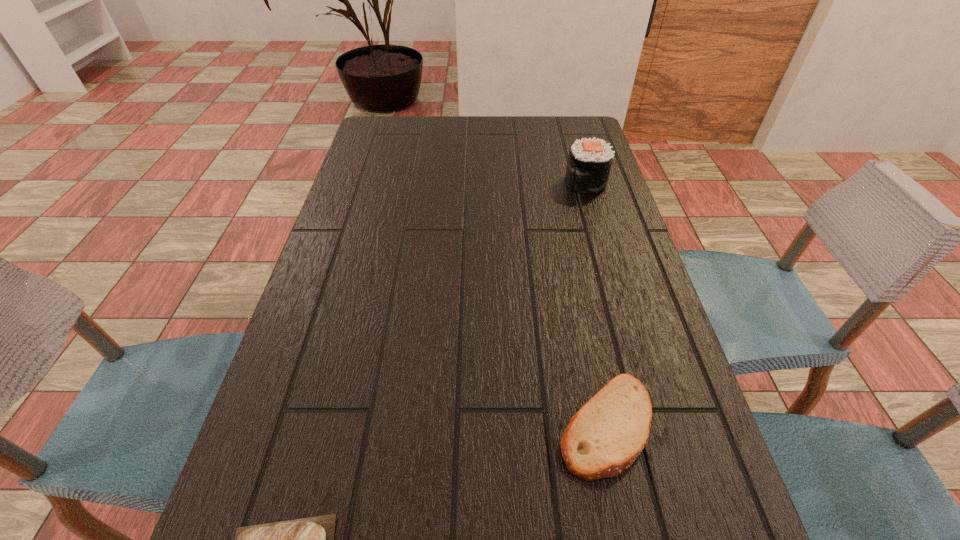
At what (x,y) coordinates should I click in order to perform the action: click on the farthest object. Please return your answer as a coordinate pair (x, y). The width and height of the screenshot is (960, 540). Looking at the image, I should click on (589, 164).

The width and height of the screenshot is (960, 540). I want to click on the tallest object, so click(x=589, y=164).

Image resolution: width=960 pixels, height=540 pixels. In order to click on the farther pita bread in this screenshot , I will do `click(608, 433)`.

Where is `the second farthest object`? the second farthest object is located at coordinates (608, 433).

In order to click on free point located 0.290m on the back of the sushi in this screenshot , I will do `click(568, 123)`.

Locate an element on the screen. The width and height of the screenshot is (960, 540). free space located on the back of the second nearest object is located at coordinates (578, 290).

The image size is (960, 540). What are the coordinates of `sushi located at the right edge` in the screenshot? It's located at (589, 164).

Find the location of `pita bread situated at the right edge`. pita bread situated at the right edge is located at coordinates (608, 433).

Find the location of a particular element. free space at the far edge is located at coordinates (531, 153).

Locate an element on the screen. This screenshot has height=540, width=960. free location at the left edge of the desktop is located at coordinates (355, 186).